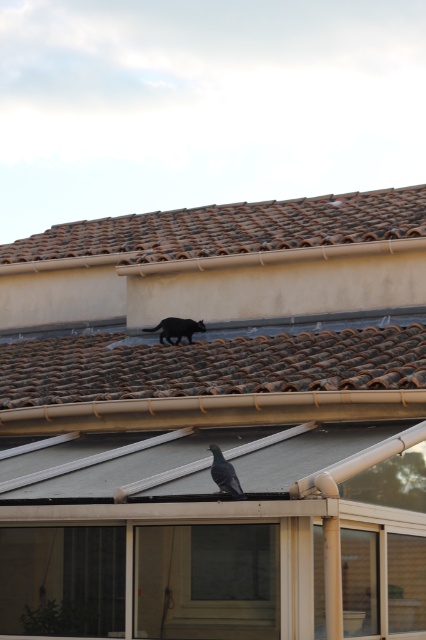
You are a bird flying towards the brown tile roof at center and the black fur cat at upper center. Which object is closer to you when you are above them?

The black fur cat at upper center is closer to you because it is located on top of the brown tile roof at center, so the distance between them is 1.70 meters.

You are a drone operator trying to capture a photo of the shiny blue pigeon at center. The drone is currently at a position directly above the roof. To ensure the pigeon is centered in the photo, where should you adjust the drone horizontally? Use the coordinate system where the bottom left corner of the image is the origin point.

The shiny blue pigeon at center is located at coordinate point 0.741 on the x axis and 0.528 on the y axis. To center the drone above the pigeon, adjust the drone horizontally to the right by 0.741 units and upwards to 0.528 units in the coordinate system provided.